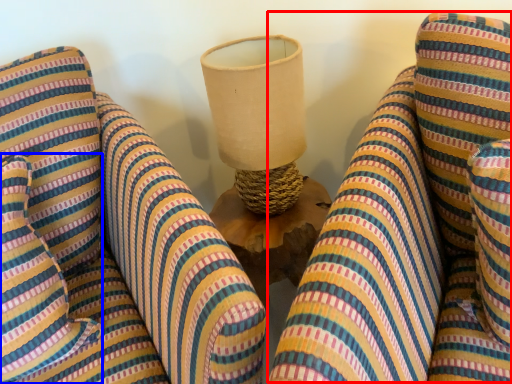
Question: Which object is further to the camera taking this photo, bean bag chair (highlighted by a red box) or pillow (highlighted by a blue box)?

Choices:
 (A) bean bag chair
 (B) pillow

Answer: (B)